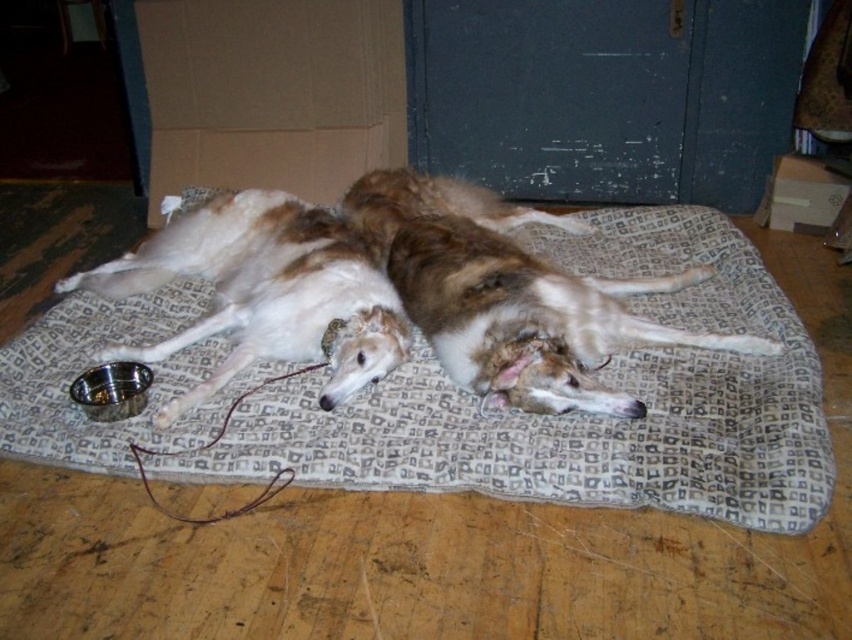
You are a dog owner who wants to ensure your brown fur dog at center has enough space to move comfortably on the patterned fabric dog bed at center. Based on the scene description, can the dog move freely on the bed?

The patterned fabric dog bed at center is much taller than the brown fur dog at center, so the dog has enough vertical space to move freely on the bed.

You are a dog owner who wants to place a new toy on the floor between the patterned fabric dog bed at center and the white fur dog at center. Based on their positions, where should you place the toy so it is equidistant from both?

The patterned fabric dog bed at center is in front of the white fur dog at center, so placing the toy directly between them on the floor would require positioning it closer to the dog bed to maintain equal distance from both.